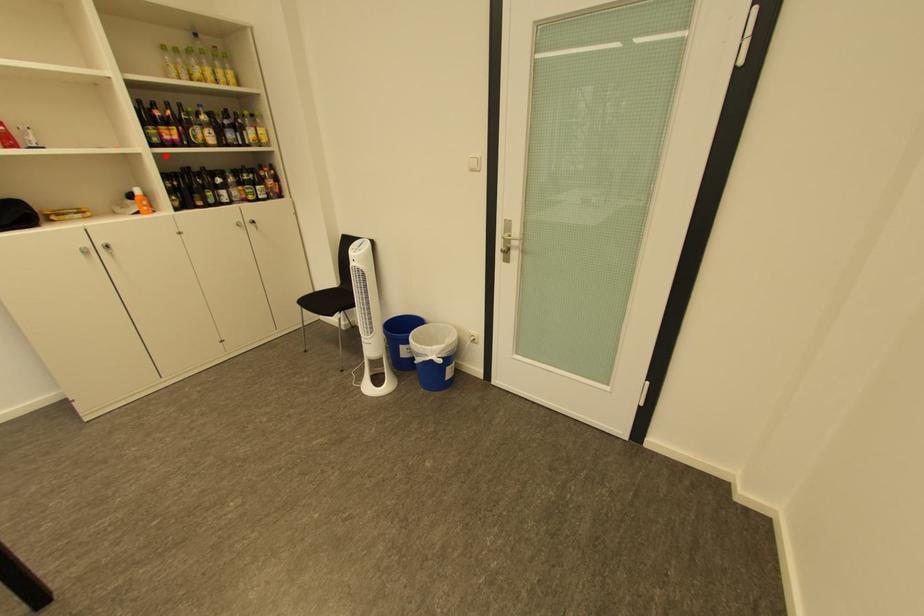
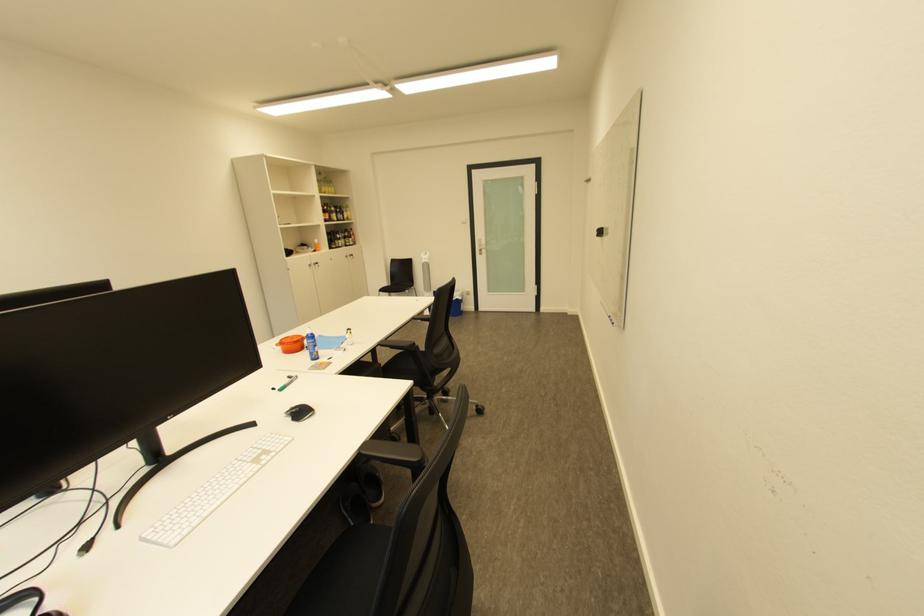
Question: I am providing you with two images of the same scene from different viewpoints. Image1 has a red point marked. In image2, the corresponding 3D location appears at what relative position? Reply with the corresponding letter.

Choices:
 (A) Closer
 (B) Farther

Answer: (A)